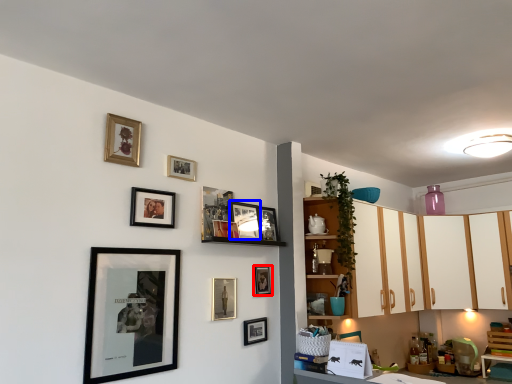
Question: Which of the following is the farthest to the observer, picture frame (highlighted by a red box) or picture frame (highlighted by a blue box)?

Choices:
 (A) picture frame
 (B) picture frame

Answer: (A)